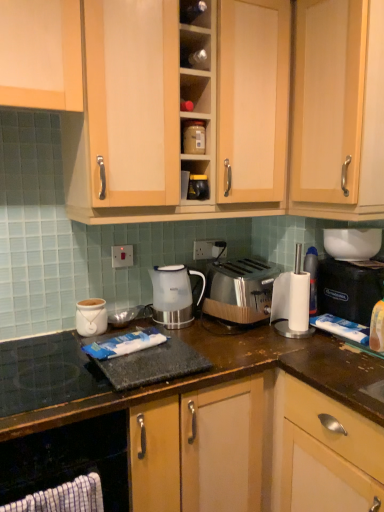
Find the location of a particular element. This screenshot has height=512, width=384. free space above white glossy bowl at upper right, the third appliance viewed from the top (from a real-world perspective) is located at coordinates (339, 225).